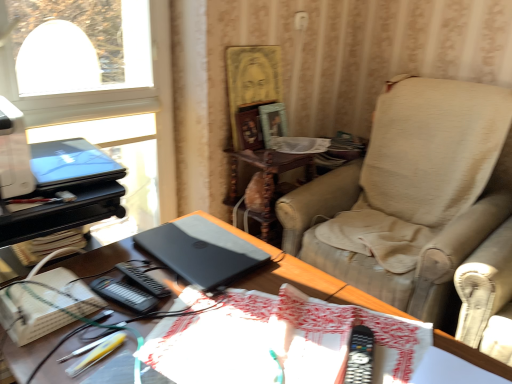
Question: Can white cardboard book at lower left be found inside satin black laptop at center?

Choices:
 (A) yes
 (B) no

Answer: (B)

Question: Is satin black laptop at center not close to white cardboard book at lower left?

Choices:
 (A) yes
 (B) no

Answer: (B)

Question: Is satin black laptop at center bigger than white cardboard book at lower left?

Choices:
 (A) no
 (B) yes

Answer: (B)

Question: Considering the relative positions of satin black laptop at center and white cardboard book at lower left in the image provided, is satin black laptop at center to the left of white cardboard book at lower left from the viewer's perspective?

Choices:
 (A) no
 (B) yes

Answer: (A)

Question: Considering the relative sizes of satin black laptop at center and white cardboard book at lower left in the image provided, is satin black laptop at center taller than white cardboard book at lower left?

Choices:
 (A) yes
 (B) no

Answer: (A)

Question: Is point (510, 137) positioned closer to the camera than point (264, 135)?

Choices:
 (A) farther
 (B) closer

Answer: (B)

Question: From a real-world perspective, relative to matte wooden picture frame at upper center, which ranks as the first picture frame in right-to-left order, is beige fabric chair at right vertically above or below?

Choices:
 (A) below
 (B) above

Answer: (A)

Question: From the image's perspective, is beige fabric chair at right above or below matte wooden picture frame at upper center, which ranks as the first picture frame in right-to-left order?

Choices:
 (A) below
 (B) above

Answer: (A)

Question: Would you say beige fabric chair at right is inside or outside matte wooden picture frame at upper center, which is the 2th picture frame in left-to-right order?

Choices:
 (A) outside
 (B) inside

Answer: (A)

Question: Visually, is wooden side table at center positioned to the left or to the right of wooden picture frame at center, acting as the first picture frame starting from the left?

Choices:
 (A) right
 (B) left

Answer: (A)

Question: Looking at their shapes, would you say wooden side table at center is wider or thinner than wooden picture frame at center, acting as the 2th picture frame starting from the right?

Choices:
 (A) thin
 (B) wide

Answer: (B)

Question: Does point (272, 180) appear closer or farther from the camera than point (259, 125)?

Choices:
 (A) farther
 (B) closer

Answer: (A)

Question: Choose the correct answer: Is wooden side table at center inside wooden picture frame at center, acting as the first picture frame starting from the left, or outside it?

Choices:
 (A) outside
 (B) inside

Answer: (A)

Question: Is white cardboard book at lower left inside or outside of matte black laptop at upper left, which is counted as the 1th laptop, starting from the top?

Choices:
 (A) inside
 (B) outside

Answer: (B)

Question: Considering the positions of point (20, 329) and point (112, 165), is point (20, 329) closer or farther from the camera than point (112, 165)?

Choices:
 (A) closer
 (B) farther

Answer: (A)